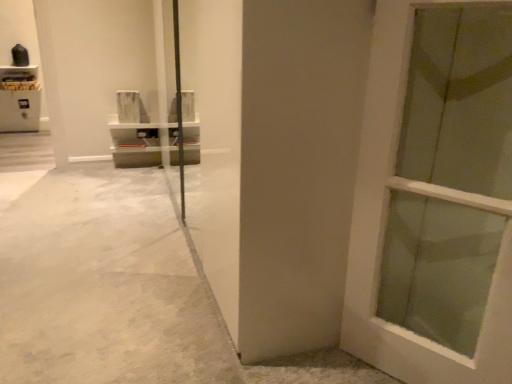
Find the location of a particular element. Image resolution: width=512 pixels, height=384 pixels. wooden shelf at upper left is located at coordinates (19, 78).

Locate an element on the screen. Image resolution: width=512 pixels, height=384 pixels. white polished concrete at center is located at coordinates (104, 286).

Which of these two, wooden shelf at upper left or white polished concrete at center, is bigger?

white polished concrete at center.

Which of these two, wooden shelf at upper left or white polished concrete at center, stands shorter?

white polished concrete at center is shorter.

From a real-world perspective, is wooden shelf at upper left positioned under white polished concrete at center based on gravity?

Actually, wooden shelf at upper left is physically above white polished concrete at center in the real world.

Based on the photo, considering the positions of objects wooden shelf at upper left and white polished concrete at center in the image provided, who is more to the left, wooden shelf at upper left or white polished concrete at center?

Positioned to the left is wooden shelf at upper left.

Is wooden shelf at upper left not inside white matte door at center?

wooden shelf at upper left lies outside white matte door at center's area.

Is white matte door at center at the back of wooden shelf at upper left?

wooden shelf at upper left does not have its back to white matte door at center.

Which is more to the left, wooden shelf at upper left or white matte door at center?

wooden shelf at upper left.

Is white matte door at center positioned behind wooden shelf at upper left?

No, the depth of white matte door at center is less than that of wooden shelf at upper left.

Is white matte door at center oriented away from wooden shelf at upper left?

white matte door at center is not turned away from wooden shelf at upper left.

From the image's perspective, between white matte door at center and wooden shelf at upper left, who is located below?

white matte door at center is shown below in the image.

Are white matte door at center and wooden shelf at upper left beside each other?

No, white matte door at center is not with wooden shelf at upper left.

Is wooden shelf at upper left a part of white polished concrete at center?

That's incorrect, wooden shelf at upper left is not inside white polished concrete at center.

Is white polished concrete at center oriented towards wooden shelf at upper left?

No, white polished concrete at center does not turn towards wooden shelf at upper left.

Consider the image. From the image's perspective, which is above, white polished concrete at center or wooden shelf at upper left?

wooden shelf at upper left.

Which of these two, white polished concrete at center or wooden shelf at upper left, stands shorter?

white polished concrete at center is shorter.

From the image's perspective, which is above, white polished concrete at center or white matte door at center?

white matte door at center is shown above in the image.

Considering the sizes of objects white polished concrete at center and white matte door at center in the image provided, who is taller, white polished concrete at center or white matte door at center?

Standing taller between the two is white matte door at center.

Which is correct: white polished concrete at center is inside white matte door at center, or outside of it?

white polished concrete at center is not enclosed by white matte door at center.

From the image's perspective, which object appears higher, white matte door at center or white polished concrete at center?

white matte door at center, from the image's perspective.

Choose the correct answer: Is white matte door at center inside white polished concrete at center or outside it?

The correct answer is: outside.

Are white matte door at center and white polished concrete at center making contact?

No, white matte door at center is not in contact with white polished concrete at center.

From a real-world perspective, between white matte door at center and white polished concrete at center, who is vertically lower?

In real-world perspective, white polished concrete at center is lower.

The width and height of the screenshot is (512, 384). Identify the location of concrete that appears on the right of wooden shelf at upper left. (104, 286).

The image size is (512, 384). What are the coordinates of `door above the wooden shelf at upper left (from a real-world perspective)` in the screenshot? It's located at (385, 224).

Estimate the real-world distances between objects in this image. Which object is further from white matte door at center, white polished concrete at center or wooden shelf at upper left?

Based on the image, wooden shelf at upper left appears to be further to white matte door at center.

From the picture: Which object lies further to the anchor point wooden shelf at upper left, white polished concrete at center or white matte door at center?

Based on the image, white matte door at center appears to be further to wooden shelf at upper left.

Considering their positions, is wooden shelf at upper left positioned further to white matte door at center than white polished concrete at center?

wooden shelf at upper left is positioned further to the anchor white matte door at center.

Which object lies nearer to the anchor point white polished concrete at center, wooden shelf at upper left or white matte door at center?

Based on the image, white matte door at center appears to be nearer to white polished concrete at center.

Considering their positions, is white matte door at center positioned closer to wooden shelf at upper left than white polished concrete at center?

The object closer to wooden shelf at upper left is white polished concrete at center.

Which object lies nearer to the anchor point white polished concrete at center, white matte door at center or wooden shelf at upper left?

white matte door at center is closer to white polished concrete at center.

Where is `concrete between white matte door at center and wooden shelf at upper left along the z-axis`? concrete between white matte door at center and wooden shelf at upper left along the z-axis is located at coordinates (104, 286).